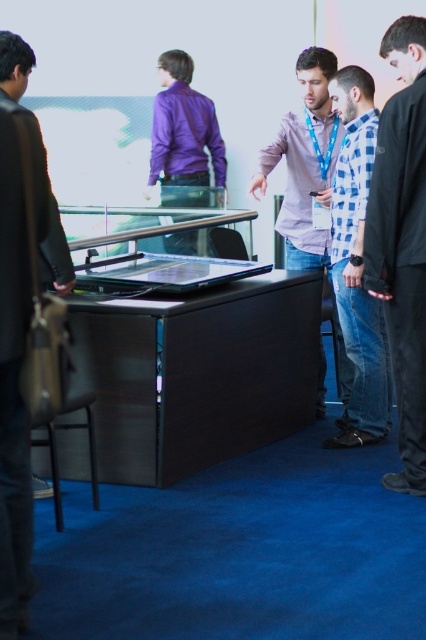
Question: Can you confirm if dark brown leather jacket at left is positioned to the left of checkered fabric shirt at center?

Choices:
 (A) yes
 (B) no

Answer: (A)

Question: Observing the image, what is the correct spatial positioning of checkered fabric shirt at center in reference to matte pink shirt at center?

Choices:
 (A) below
 (B) above

Answer: (A)

Question: Considering the real-world distances, which object is farthest from the dark brown leather jacket at left?

Choices:
 (A) black cotton shirt at right
 (B) checkered fabric shirt at center
 (C) purple smooth shirt at upper left
 (D) matte pink shirt at center

Answer: (C)

Question: Is dark brown leather jacket at left to the right of purple smooth shirt at upper left from the viewer's perspective?

Choices:
 (A) no
 (B) yes

Answer: (A)

Question: Estimate the real-world distances between objects in this image. Which object is closer to the black cotton shirt at right?

Choices:
 (A) matte pink shirt at center
 (B) dark brown leather jacket at left

Answer: (A)

Question: Which of the following is the farthest from the observer?

Choices:
 (A) pyautogui.click(x=357, y=365)
 (B) pyautogui.click(x=37, y=147)
 (C) pyautogui.click(x=291, y=224)

Answer: (C)